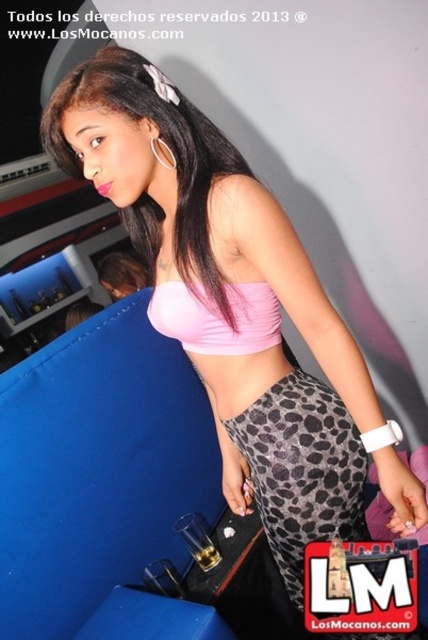
You are a photographer setting up a shoot in this room. You need to place a small prop exactly at the point marked as point (303, 470). What object will this prop be placed on or near?

The prop will be placed near the leopard print leggings at lower center, as that is the object located at point (303, 470).